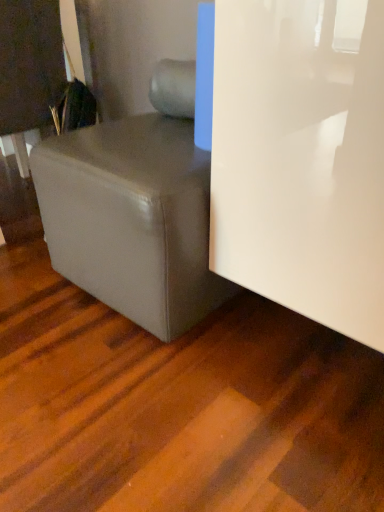
At what (x,y) coordinates should I click in order to perform the action: click on matte gray ottoman at lower left. Please return your answer as a coordinate pair (x, y). This screenshot has width=384, height=512. Looking at the image, I should click on (132, 219).

Which is more distant, (300, 185) or (79, 278)?

Positioned behind is point (79, 278).

What's the angular difference between white glossy door at right and matte gray ottoman at lower left's facing directions?

The angle between the facing direction of white glossy door at right and the facing direction of matte gray ottoman at lower left is 4.65e-05 degrees.

Which is in front, white glossy door at right or matte gray ottoman at lower left?

white glossy door at right is closer to the camera.

From a real-world perspective, is white glossy door at right located higher than matte gray ottoman at lower left?

Yes, from a real-world perspective, white glossy door at right is above matte gray ottoman at lower left.

This screenshot has height=512, width=384. Identify the location of furniture that is on the left side of matte gray ottoman at lower left. 28,69.

How distant is matte gray ottoman at lower left from matte black book at upper left?

A distance of 24.09 inches exists between matte gray ottoman at lower left and matte black book at upper left.

Is point (45, 211) closer or farther from the camera than point (6, 1)?

Point (45, 211) is closer to the camera than point (6, 1).

From a real-world perspective, between matte black book at upper left and matte gray ottoman at lower left, who is vertically lower?

matte gray ottoman at lower left is physically lower.

Between matte black book at upper left and matte gray ottoman at lower left, which one appears on the left side from the viewer's perspective?

Positioned to the left is matte black book at upper left.

Which of these two, matte black book at upper left or matte gray ottoman at lower left, is thinner?

With smaller width is matte black book at upper left.

Is matte black book at upper left facing away from matte gray ottoman at lower left?

No, matte black book at upper left's orientation is not away from matte gray ottoman at lower left.

From the image's perspective, is white glossy door at right located above matte black book at upper left?

No, from the image's perspective, white glossy door at right is not over matte black book at upper left.

Which is behind, point (367, 304) or point (29, 93)?

The point (29, 93) is farther.

Is white glossy door at right bigger than matte black book at upper left?

Yes, white glossy door at right is bigger than matte black book at upper left.

Does white glossy door at right appear on the left side of matte black book at upper left?

In fact, white glossy door at right is to the right of matte black book at upper left.

Does matte gray ottoman at lower left have a greater height compared to white glossy door at right?

In fact, matte gray ottoman at lower left may be shorter than white glossy door at right.

Find the location of a particular element. table below the white glossy door at right (from a real-world perspective) is located at coordinates (132, 219).

Is matte gray ottoman at lower left far away from white glossy door at right?

They are positioned close to each other.

Is matte black book at upper left positioned behind white glossy door at right?

Yes, matte black book at upper left is behind white glossy door at right.

Is white glossy door at right at the back of matte black book at upper left?

No, matte black book at upper left is not facing the opposite direction of white glossy door at right.

Considering the sizes of matte black book at upper left and white glossy door at right in the image, is matte black book at upper left wider or thinner than white glossy door at right?

Answer: Considering their sizes, matte black book at upper left looks slimmer than white glossy door at right.

You are a GUI agent. You are given a task and a screenshot of the screen. Output one action in this format:
    pyautogui.click(x=<x>, y=<y>)
    Task: Click on the glass door on the right of matte gray ottoman at lower left
    This screenshot has width=384, height=512.
    Given the screenshot: What is the action you would take?
    pyautogui.click(x=301, y=158)

The width and height of the screenshot is (384, 512). I want to click on table below the matte black book at upper left (from a real-world perspective), so click(x=132, y=219).

Looking at the image, which one is located closer to matte black book at upper left, white glossy door at right or matte gray ottoman at lower left?

matte gray ottoman at lower left lies closer to matte black book at upper left than the other object.

When comparing their distances from white glossy door at right, does matte gray ottoman at lower left or matte black book at upper left seem closer?

matte gray ottoman at lower left.

Consider the image. Looking at the image, which one is located closer to matte gray ottoman at lower left, matte black book at upper left or white glossy door at right?

white glossy door at right.

When comparing their distances from matte black book at upper left, does matte gray ottoman at lower left or white glossy door at right seem further?

white glossy door at right.

Estimate the real-world distances between objects in this image. Which object is further from matte gray ottoman at lower left, white glossy door at right or matte black book at upper left?

Among the two, matte black book at upper left is located further to matte gray ottoman at lower left.

Based on their spatial positions, is matte black book at upper left or matte gray ottoman at lower left further from white glossy door at right?

matte black book at upper left is positioned further to the anchor white glossy door at right.

Image resolution: width=384 pixels, height=512 pixels. In order to click on table located between matte black book at upper left and white glossy door at right in the left-right direction in this screenshot , I will do `click(132, 219)`.